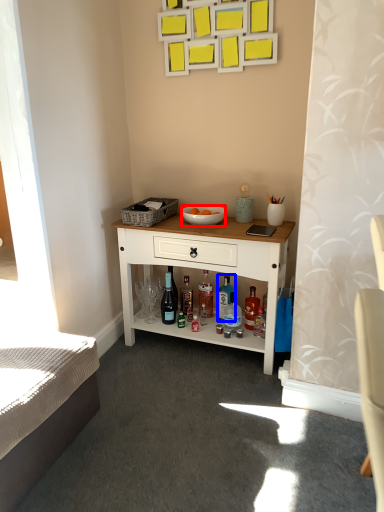
Question: Which of the following is the farthest to the observer, bowl (highlighted by a red box) or bottle (highlighted by a blue box)?

Choices:
 (A) bowl
 (B) bottle

Answer: (B)